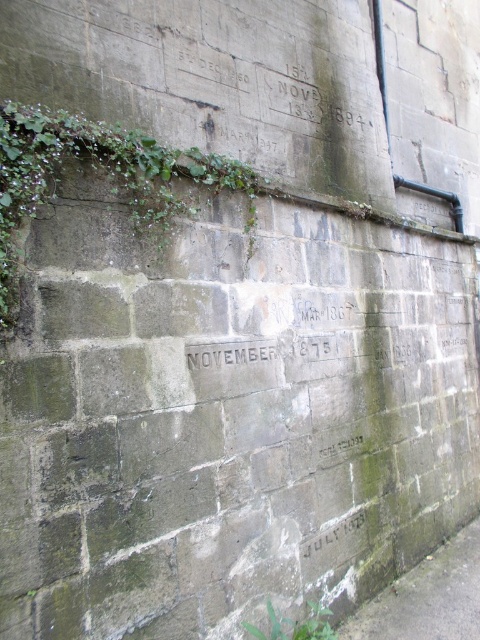
Question: Considering the relative positions of green mossy ivy at upper left and green leafy weed at lower center in the image provided, where is green mossy ivy at upper left located with respect to green leafy weed at lower center?

Choices:
 (A) left
 (B) right

Answer: (A)

Question: Is green mossy ivy at upper left closer to camera compared to dark gray stone text at center?

Choices:
 (A) no
 (B) yes

Answer: (B)

Question: Which point is farther to the camera?

Choices:
 (A) green leafy weed at lower center
 (B) dark gray stone text at center

Answer: (B)

Question: Which object is the farthest from the green leafy weed at lower center?

Choices:
 (A) green mossy ivy at upper left
 (B) dark gray stone text at center

Answer: (A)

Question: Can you confirm if green mossy ivy at upper left is smaller than green leafy weed at lower center?

Choices:
 (A) no
 (B) yes

Answer: (A)

Question: Which object is positioned farthest from the green mossy ivy at upper left?

Choices:
 (A) green leafy weed at lower center
 (B) dark gray stone text at center

Answer: (A)